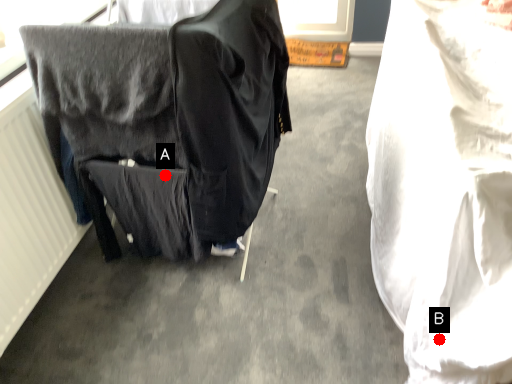
Question: Two points are circled on the image, labeled by A and B beside each circle. Which point is farther from the camera taking this photo?

Choices:
 (A) A is further
 (B) B is further

Answer: (A)